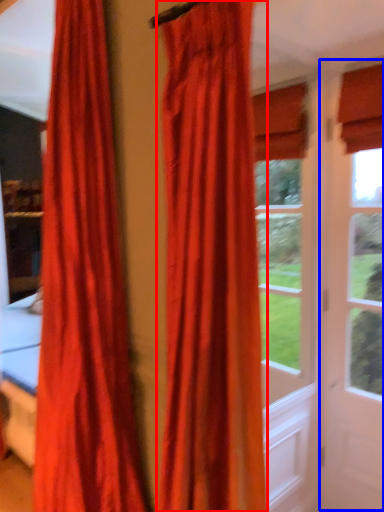
Question: Which of the following is the closest to the observer, curtain (highlighted by a red box) or screen door (highlighted by a blue box)?

Choices:
 (A) curtain
 (B) screen door

Answer: (A)